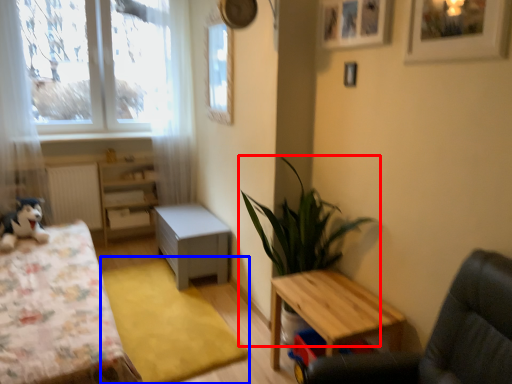
Question: Which object appears closest to the camera in this image, houseplant (highlighted by a red box) or mat (highlighted by a blue box)?

Choices:
 (A) houseplant
 (B) mat

Answer: (A)